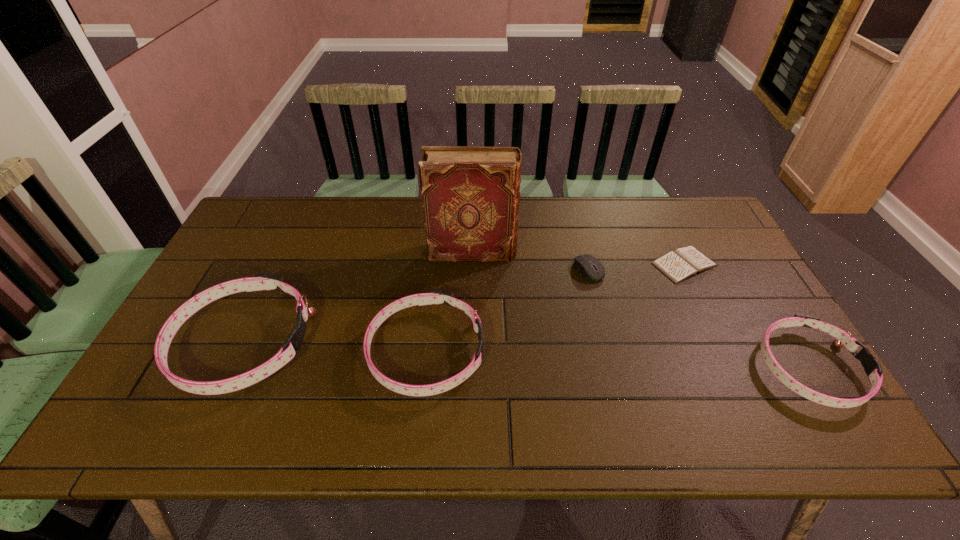
To make them evenly spaced by inserting another dog_collar among them, please locate a vacant spot for this new dog_collar. Please provide its 2D coordinates. Your answer should be formatted as a tuple, i.e. [(x, y)], where the tuple contains the x and y coordinates of a point satisfying the conditions above.

[(614, 360)]